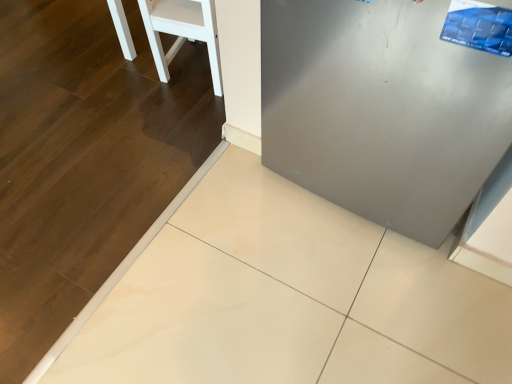
This screenshot has width=512, height=384. What do you see at coordinates (182, 32) in the screenshot?
I see `white matte chair at upper left` at bounding box center [182, 32].

You are a GUI agent. You are given a task and a screenshot of the screen. Output one action in this format:
    pyautogui.click(x=<x>, y=<y>)
    Task: Click on the white matte chair at upper left
    
    Given the screenshot: What is the action you would take?
    pyautogui.click(x=182, y=32)

The width and height of the screenshot is (512, 384). Identify the location of white matte chair at upper left. (182, 32).